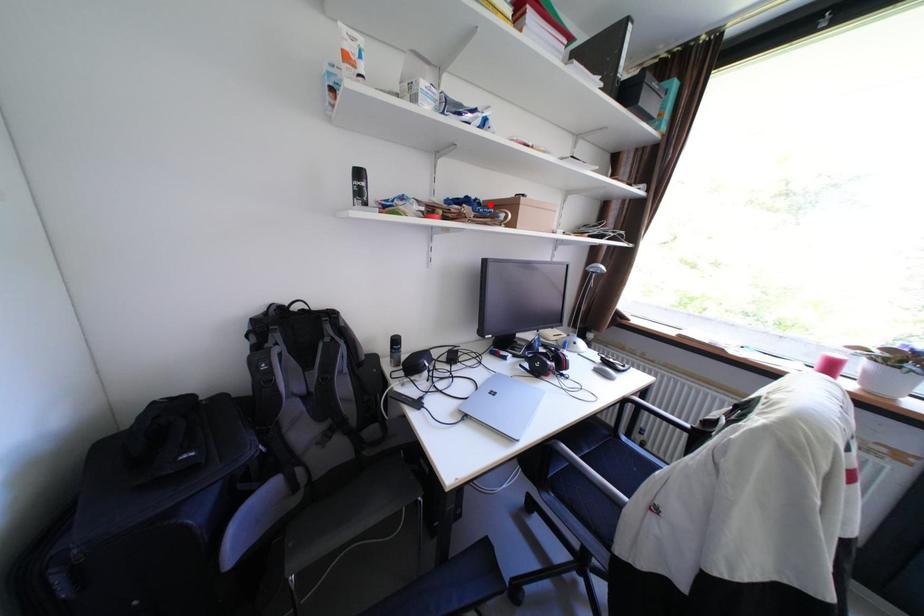
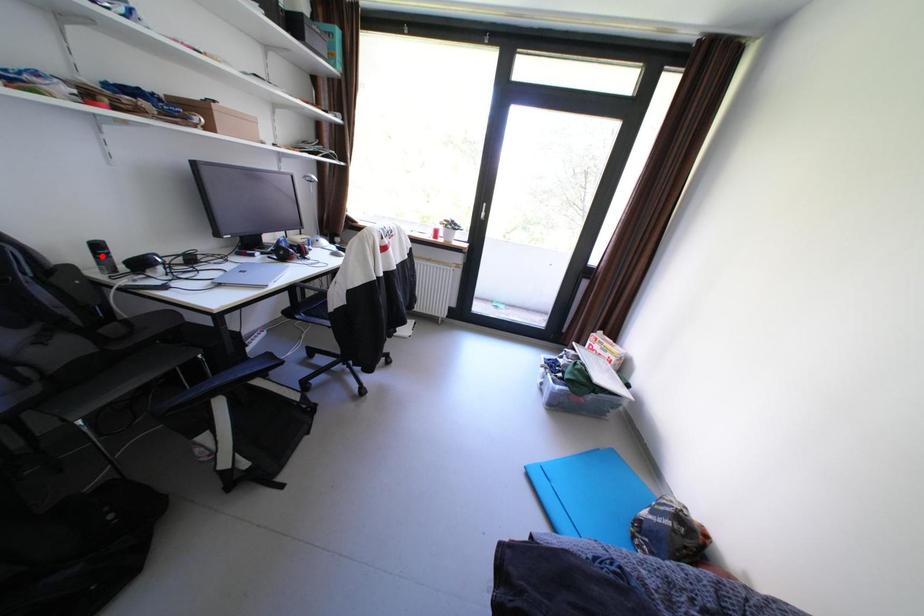
I am providing you with two images of the same scene from different viewpoints. A red point is marked on the first image and another point is marked on the second image. Are the points marked in image1 and image2 representing the same 3D position?

No